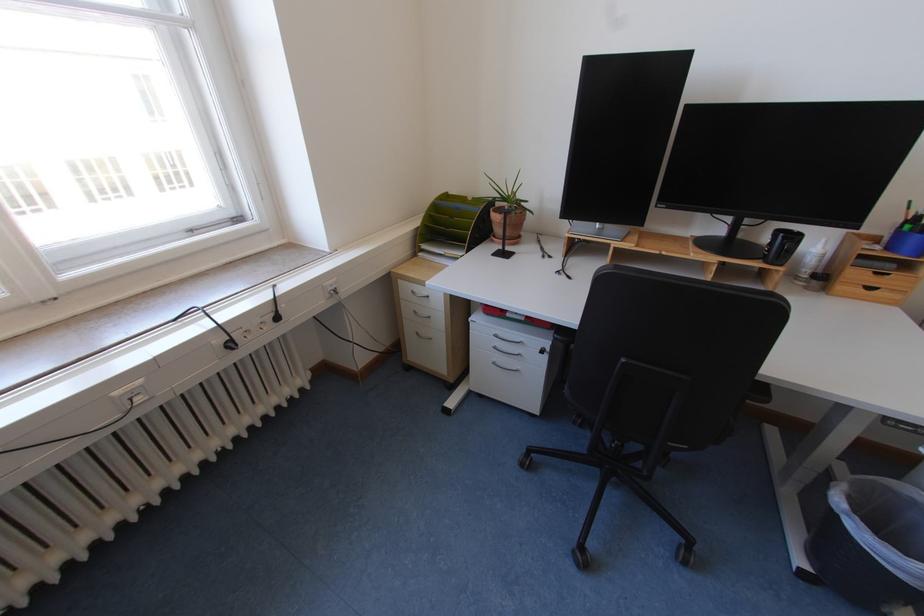
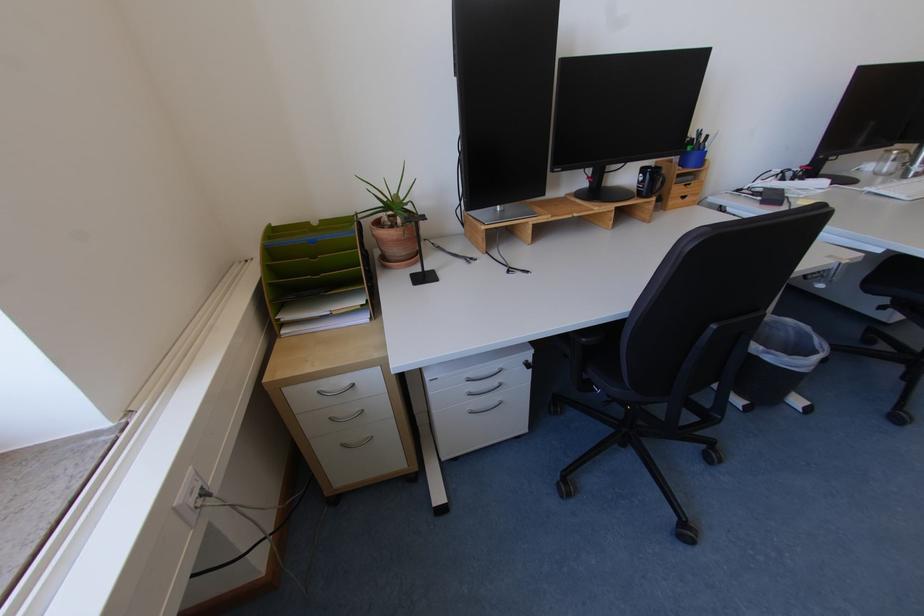
Locate, in the second image, the point that corresponds to [420,293] in the first image.

(327, 392)